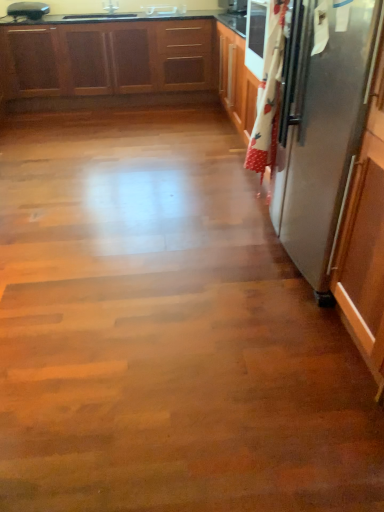
What is the approximate height of white glossy sink at upper center?

It is 7.90 centimeters.

Describe the element at coordinates (322, 126) in the screenshot. I see `satin silver refrigerator at right` at that location.

Where is `white glossy sink at upper center`? white glossy sink at upper center is located at coordinates (164, 10).

Considering the relative sizes of metallic silver toaster at upper left and satin silver refrigerator at right in the image provided, is metallic silver toaster at upper left taller than satin silver refrigerator at right?

Incorrect, the height of metallic silver toaster at upper left is not larger of that of satin silver refrigerator at right.

Between point (14, 17) and point (282, 129), which one is positioned behind?

The point (14, 17) is farther.

Is metallic silver toaster at upper left oriented away from satin silver refrigerator at right?

metallic silver toaster at upper left is not turned away from satin silver refrigerator at right.

From the image's perspective, who appears lower, wooden cabinets at upper left or metallic silver toaster at upper left?

wooden cabinets at upper left appears lower in the image.

From the picture: Choose the correct answer: Is wooden cabinets at upper left inside metallic silver toaster at upper left or outside it?

wooden cabinets at upper left lies outside metallic silver toaster at upper left.

In the image, is wooden cabinets at upper left on the left side or the right side of metallic silver toaster at upper left?

wooden cabinets at upper left is positioned on metallic silver toaster at upper left's right side.

How distant is wooden cabinets at upper left from metallic silver toaster at upper left?

The distance of wooden cabinets at upper left from metallic silver toaster at upper left is 78.75 centimeters.

From a real-world perspective, relative to white glossy sink at upper center, is satin silver refrigerator at right vertically above or below?

In terms of real-world spatial position, satin silver refrigerator at right is below white glossy sink at upper center.

Is satin silver refrigerator at right far away from white glossy sink at upper center?

That's right, there is a large distance between satin silver refrigerator at right and white glossy sink at upper center.

Choose the correct answer: Is satin silver refrigerator at right inside white glossy sink at upper center or outside it?

satin silver refrigerator at right is spatially situated outside white glossy sink at upper center.

The width and height of the screenshot is (384, 512). I want to click on sink located above the satin silver refrigerator at right (from the image's perspective), so click(x=164, y=10).

How far apart are metallic silver toaster at upper left and white glossy sink at upper center?

A distance of 4.07 feet exists between metallic silver toaster at upper left and white glossy sink at upper center.

Who is shorter, metallic silver toaster at upper left or white glossy sink at upper center?

white glossy sink at upper center.

Considering the positions of objects metallic silver toaster at upper left and white glossy sink at upper center in the image provided, who is more to the left, metallic silver toaster at upper left or white glossy sink at upper center?

metallic silver toaster at upper left.

Is point (18, 8) closer or farther from the camera than point (163, 14)?

Point (18, 8) appears to be closer to the viewer than point (163, 14).

Could you tell me if white glossy sink at upper center is facing metallic silver toaster at upper left?

No.

From a real-world perspective, is white glossy sink at upper center above or below metallic silver toaster at upper left?

white glossy sink at upper center is situated lower than metallic silver toaster at upper left in the real world.

Is point (170, 11) less distant than point (27, 8)?

No, (170, 11) is behind (27, 8).

From the image's perspective, between white glossy sink at upper center and metallic silver toaster at upper left, who is located below?

metallic silver toaster at upper left appears lower in the image.

From the image's perspective, which is above, satin silver refrigerator at right or metallic silver toaster at upper left?

metallic silver toaster at upper left.

Based on the photo, between satin silver refrigerator at right and metallic silver toaster at upper left, which one has larger width?

Wider between the two is satin silver refrigerator at right.

Is satin silver refrigerator at right positioned far away from metallic silver toaster at upper left?

Indeed, satin silver refrigerator at right is not near metallic silver toaster at upper left.

Considering the sizes of objects satin silver refrigerator at right and metallic silver toaster at upper left in the image provided, who is bigger, satin silver refrigerator at right or metallic silver toaster at upper left?

Bigger between the two is satin silver refrigerator at right.

Based on their sizes in the image, would you say wooden cabinets at upper left is bigger or smaller than white glossy sink at upper center?

In the image, wooden cabinets at upper left appears to be larger than white glossy sink at upper center.

Does point (136, 41) come behind point (154, 15)?

Yes, it is.

Between wooden cabinets at upper left and white glossy sink at upper center, which one appears on the left side from the viewer's perspective?

wooden cabinets at upper left.

Is wooden cabinets at upper left positioned before white glossy sink at upper center?

Yes.

Locate an element on the screen. The width and height of the screenshot is (384, 512). refrigerator below the metallic silver toaster at upper left (from the image's perspective) is located at coordinates (322, 126).

Where is `cabinetry on the right of the metallic silver toaster at upper left`? cabinetry on the right of the metallic silver toaster at upper left is located at coordinates (124, 60).

Considering their positions, is wooden cabinets at upper left positioned closer to satin silver refrigerator at right than metallic silver toaster at upper left?

wooden cabinets at upper left is closer to satin silver refrigerator at right.

Which object lies nearer to the anchor point wooden cabinets at upper left, metallic silver toaster at upper left or satin silver refrigerator at right?

metallic silver toaster at upper left is positioned closer to the anchor wooden cabinets at upper left.

In the scene shown: Estimate the real-world distances between objects in this image. Which object is further from metallic silver toaster at upper left, white glossy sink at upper center or wooden cabinets at upper left?

white glossy sink at upper center is further to metallic silver toaster at upper left.

Based on the photo, considering their positions, is satin silver refrigerator at right positioned further to metallic silver toaster at upper left than white glossy sink at upper center?

satin silver refrigerator at right.

Considering their positions, is satin silver refrigerator at right positioned further to wooden cabinets at upper left than white glossy sink at upper center?

The object further to wooden cabinets at upper left is satin silver refrigerator at right.

Considering their positions, is satin silver refrigerator at right positioned closer to wooden cabinets at upper left than metallic silver toaster at upper left?

The object closer to wooden cabinets at upper left is metallic silver toaster at upper left.

Considering their positions, is metallic silver toaster at upper left positioned closer to wooden cabinets at upper left than white glossy sink at upper center?

white glossy sink at upper center lies closer to wooden cabinets at upper left than the other object.

When comparing their distances from wooden cabinets at upper left, does white glossy sink at upper center or satin silver refrigerator at right seem further?

Among the two, satin silver refrigerator at right is located further to wooden cabinets at upper left.

Locate an element on the screen. The image size is (384, 512). cabinetry located between satin silver refrigerator at right and metallic silver toaster at upper left in the depth direction is located at coordinates (124, 60).

Identify the location of cabinetry between metallic silver toaster at upper left and white glossy sink at upper center. Image resolution: width=384 pixels, height=512 pixels. (124, 60).

You are a GUI agent. You are given a task and a screenshot of the screen. Output one action in this format:
    pyautogui.click(x=<x>, y=<y>)
    Task: Click on the cabinetry between satin silver refrigerator at right and white glossy sink at upper center from front to back
    The width and height of the screenshot is (384, 512).
    Given the screenshot: What is the action you would take?
    pyautogui.click(x=124, y=60)

The width and height of the screenshot is (384, 512). I want to click on appliance located between satin silver refrigerator at right and white glossy sink at upper center in the depth direction, so click(28, 10).